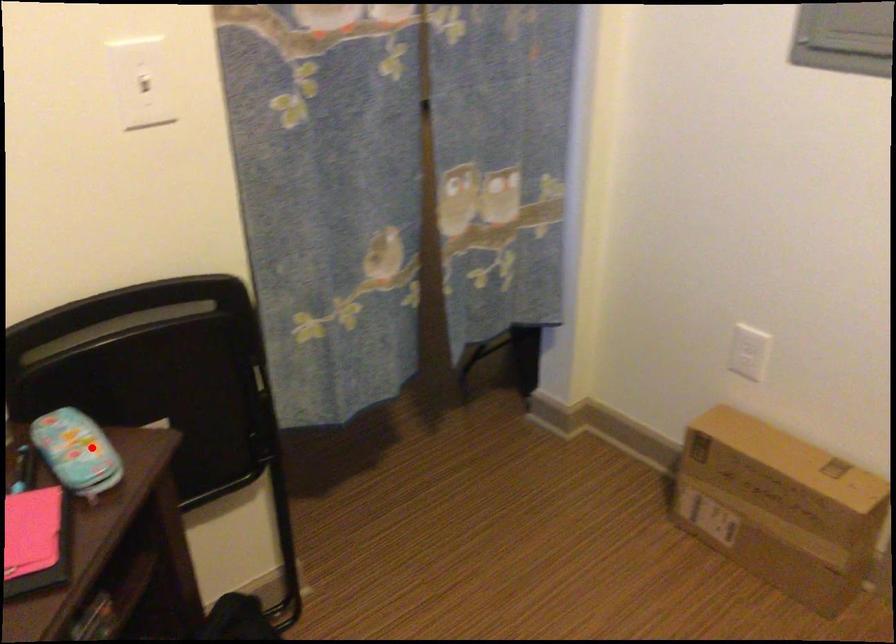
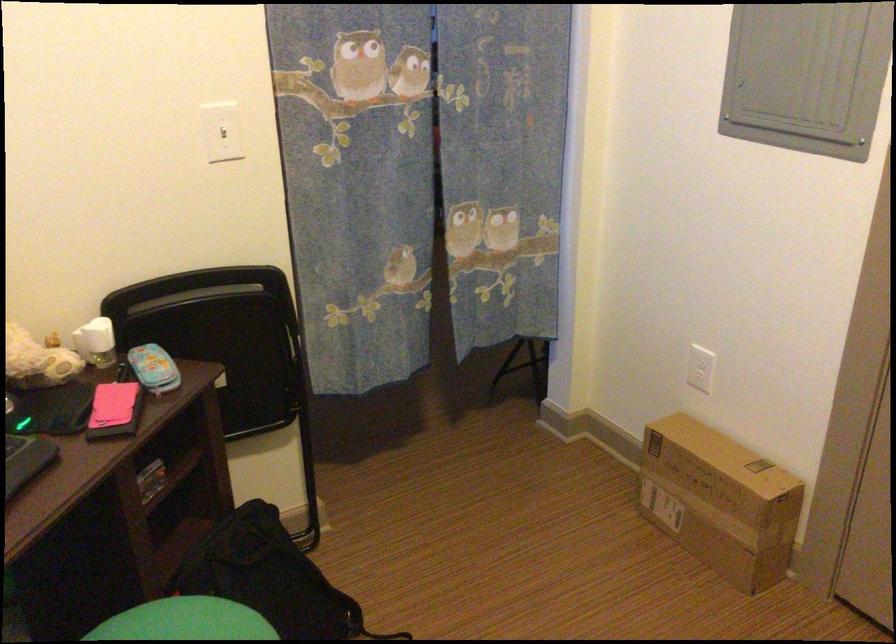
Where in the second image is the point corresponding to the highlighted location from the first image?

(153, 368)